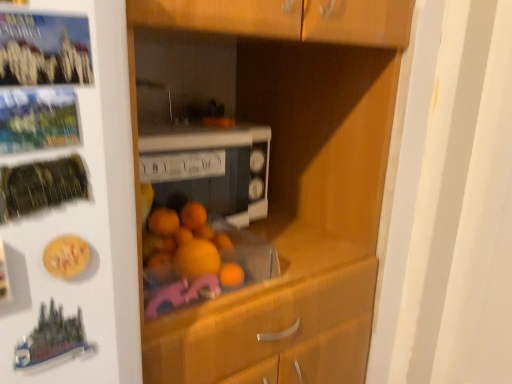
What do you see at coordinates (208, 169) in the screenshot? I see `white glossy microwave at center` at bounding box center [208, 169].

Locate an element on the screen. white glossy microwave at center is located at coordinates (208, 169).

What is the approximate width of metallic silver button at upper left?

1.79 centimeters.

Measure the distance between metallic silver button at upper left and camera.

metallic silver button at upper left and camera are 15.75 inches apart from each other.

This screenshot has width=512, height=384. What do you see at coordinates (38, 119) in the screenshot? I see `metallic silver button at upper left` at bounding box center [38, 119].

You are a GUI agent. You are given a task and a screenshot of the screen. Output one action in this format:
    pyautogui.click(x=<x>, y=<y>)
    Task: Click on the metallic silver button at upper left
    The image size is (512, 384).
    Given the screenshot: What is the action you would take?
    pyautogui.click(x=38, y=119)

This screenshot has height=384, width=512. In order to click on white glossy microwave at center in this screenshot , I will do `click(208, 169)`.

Which is more to the left, white glossy microwave at center or metallic silver button at upper left?

Positioned to the left is metallic silver button at upper left.

Considering the positions of objects white glossy microwave at center and metallic silver button at upper left in the image provided, who is behind, white glossy microwave at center or metallic silver button at upper left?

white glossy microwave at center is further from the camera.

Considering the points (227, 164) and (2, 122), which point is in front, point (227, 164) or point (2, 122)?

Positioned in front is point (2, 122).

Consider the image. From the image's perspective, is white glossy microwave at center located beneath metallic silver button at upper left?

Yes, from the image's perspective, white glossy microwave at center is below metallic silver button at upper left.

Consider the image. From a real-world perspective, is white glossy microwave at center physically below metallic silver button at upper left?

Indeed, from a real-world perspective, white glossy microwave at center is positioned beneath metallic silver button at upper left.

Between white glossy microwave at center and metallic silver button at upper left, which one has larger width?

Wider between the two is white glossy microwave at center.

Which of these two, white glossy microwave at center or metallic silver button at upper left, stands taller?

white glossy microwave at center is taller.

Considering the sizes of objects white glossy microwave at center and metallic silver button at upper left in the image provided, who is smaller, white glossy microwave at center or metallic silver button at upper left?

metallic silver button at upper left.

Is metallic silver button at upper left located within white glossy microwave at center?

Actually, metallic silver button at upper left is outside white glossy microwave at center.

Are white glossy microwave at center and metallic silver button at upper left beside each other?

white glossy microwave at center is not next to metallic silver button at upper left, and they're not touching.

Is white glossy microwave at center positioned with its back to metallic silver button at upper left?

No, white glossy microwave at center's orientation is not away from metallic silver button at upper left.

How far apart are white glossy microwave at center and metallic silver button at upper left?

white glossy microwave at center and metallic silver button at upper left are 22.18 inches apart.

Identify the location of button in front of the white glossy microwave at center. (38, 119).

Is metallic silver button at upper left to the right of white glossy microwave at center from the viewer's perspective?

No, metallic silver button at upper left is not to the right of white glossy microwave at center.

Considering their positions, is metallic silver button at upper left located in front of or behind white glossy microwave at center?

metallic silver button at upper left is positioned closer to the viewer than white glossy microwave at center.

Which is behind, point (41, 96) or point (239, 194)?

The point (239, 194) is farther from the camera.

From the image's perspective, is metallic silver button at upper left beneath white glossy microwave at center?

Incorrect, from the image's perspective, metallic silver button at upper left is higher than white glossy microwave at center.

From a real-world perspective, is metallic silver button at upper left below white glossy microwave at center?

Incorrect, from a real-world perspective, metallic silver button at upper left is higher than white glossy microwave at center.

Looking at their sizes, would you say metallic silver button at upper left is wider or thinner than white glossy microwave at center?

Considering their sizes, metallic silver button at upper left looks slimmer than white glossy microwave at center.

In terms of height, does metallic silver button at upper left look taller or shorter compared to white glossy microwave at center?

In the image, metallic silver button at upper left appears to be shorter than white glossy microwave at center.

Based on their sizes in the image, would you say metallic silver button at upper left is bigger or smaller than white glossy microwave at center?

Considering their sizes, metallic silver button at upper left takes up less space than white glossy microwave at center.

Is metallic silver button at upper left completely or partially outside of white glossy microwave at center?

Yes, metallic silver button at upper left is located beyond the bounds of white glossy microwave at center.

Are metallic silver button at upper left and white glossy microwave at center far apart?

That's not correct — metallic silver button at upper left is a little close to white glossy microwave at center.

Is metallic silver button at upper left oriented away from white glossy microwave at center?

No, metallic silver button at upper left is not facing away from white glossy microwave at center.

From the picture: How different are the orientations of metallic silver button at upper left and white glossy microwave at center in degrees?

The facing directions of metallic silver button at upper left and white glossy microwave at center are 4.57 degrees apart.

Find the location of a particular element. home appliance behind the metallic silver button at upper left is located at coordinates 208,169.

Locate an element on the screen. button located on the left of white glossy microwave at center is located at coordinates pos(38,119).

I want to click on home appliance that appears on the right of metallic silver button at upper left, so click(208, 169).